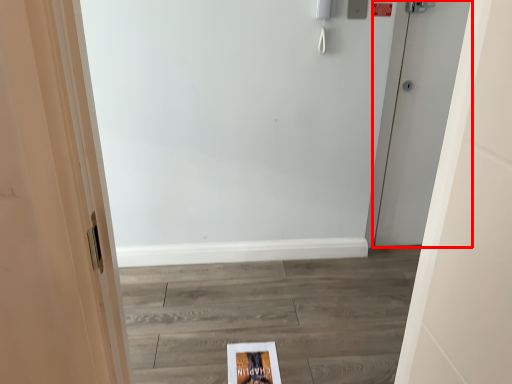
Question: From the image's perspective, considering the relative positions of door (annotated by the red box) and flyer in the image provided, where is door (annotated by the red box) located with respect to the staircase?

Choices:
 (A) below
 (B) above

Answer: (B)